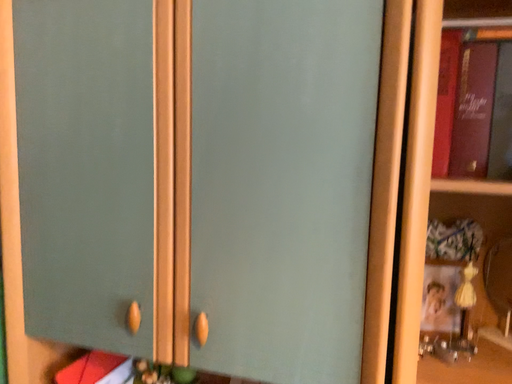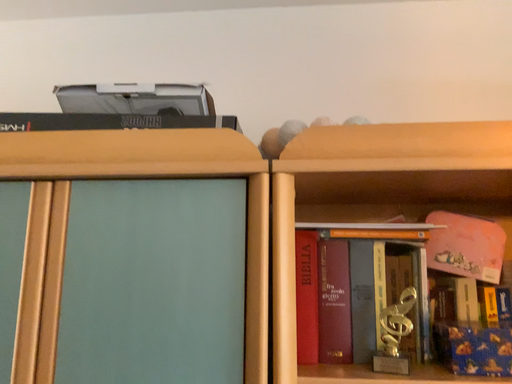
Question: How did the camera likely rotate when shooting the video?

Choices:
 (A) rotated downward
 (B) rotated upward

Answer: (B)